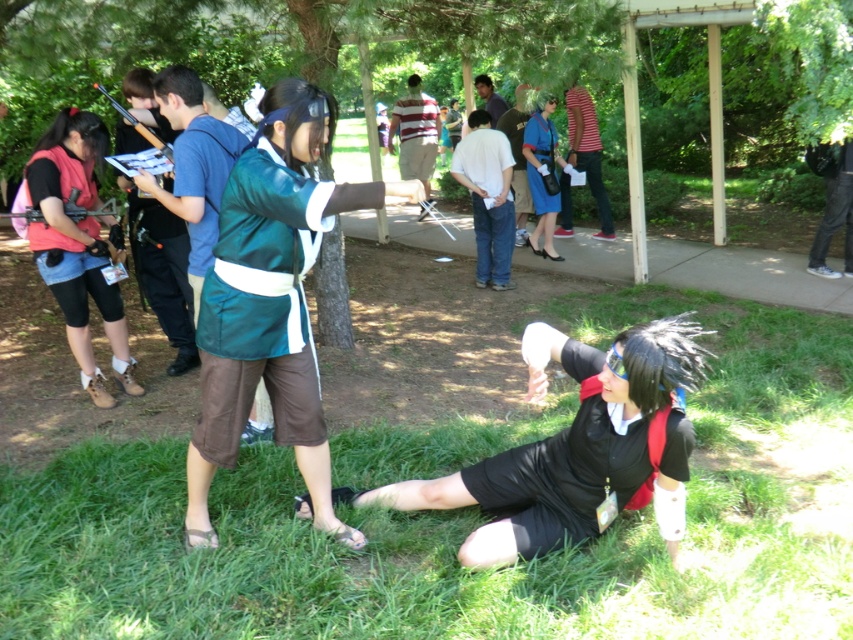
You are a photographer at the cosplay event and need to capture a photo of both the blue fabric shirt at upper center and the denim jeans at center in the same frame. Given that your camera has a maximum focus range of 5 meters, will you be able to include both in the photo?

The blue fabric shirt at upper center and denim jeans at center are 5.39 meters apart from each other. Since the distance between them exceeds the camera maximum focus range of 5 meters, you won exceed the camera maximum focus range of 5 meters, so you won will not be able to include both in the photo.

Based on the photo, you are a photographer at the cosplay event and want to capture a photo that includes both the green satin kimono at center and the blue fabric shirt at upper center. Which object should be positioned closer to the camera to ensure both are visible in the frame?

The green satin kimono at center is in front of the blue fabric shirt at upper center, so positioning the green satin kimono at center closer to the camera will ensure both are visible in the frame.